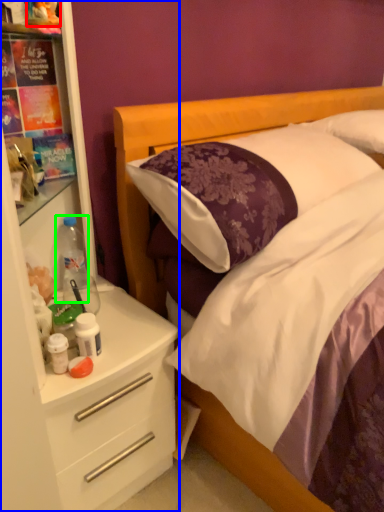
Question: Based on their relative distances, which object is farther from toy (highlighted by a red box)? Choose from dresser (highlighted by a blue box) and bottle (highlighted by a green box).

Choices:
 (A) dresser
 (B) bottle

Answer: (A)